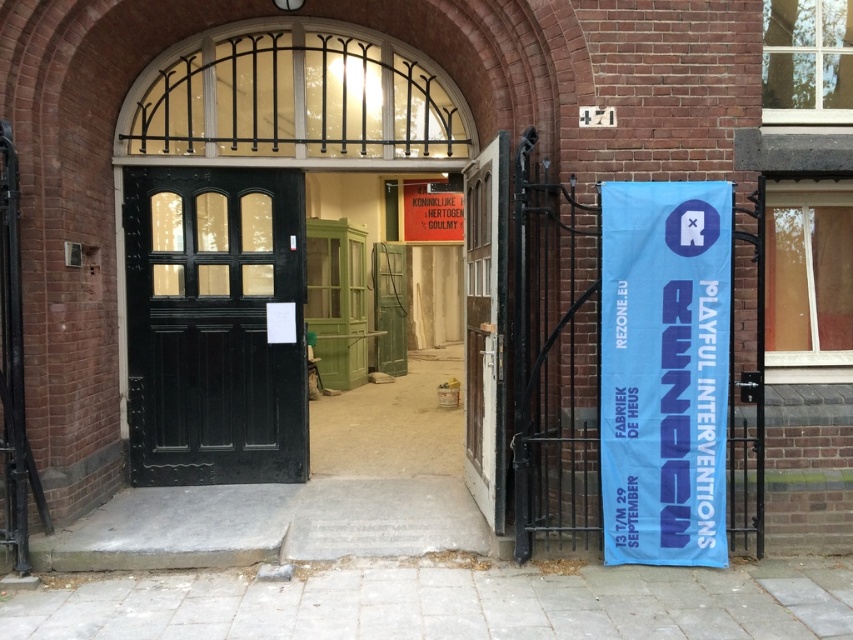
Question: Which point is farther from the camera taking this photo?

Choices:
 (A) (643, 540)
 (B) (498, 496)

Answer: (B)

Question: Is matte black door at center further to camera compared to blue fabric banner at right?

Choices:
 (A) no
 (B) yes

Answer: (B)

Question: Can you confirm if blue fabric banner at right is positioned above wooden door at center?

Choices:
 (A) yes
 (B) no

Answer: (B)

Question: Which point is farther to the camera?

Choices:
 (A) blue fabric banner at right
 (B) matte black door at center

Answer: (B)

Question: Is matte black door at center bigger than blue fabric banner at right?

Choices:
 (A) no
 (B) yes

Answer: (B)

Question: Among these objects, which one is nearest to the camera?

Choices:
 (A) blue fabric banner at right
 (B) matte black door at center

Answer: (A)